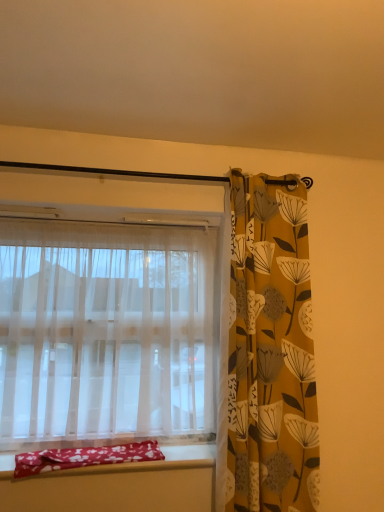
Question: Is yellow floral fabric curtain at right, which is the first curtain in right-to-left order, a part of sheer white curtain at left, which appears as the first curtain when viewed from the left?

Choices:
 (A) no
 (B) yes

Answer: (A)

Question: Is sheer white curtain at left, arranged as the second curtain when viewed from the right, smaller than yellow floral fabric curtain at right, which is the first curtain in right-to-left order?

Choices:
 (A) no
 (B) yes

Answer: (A)

Question: Is sheer white curtain at left, arranged as the second curtain when viewed from the right, in contact with yellow floral fabric curtain at right, the 2th curtain viewed from the left?

Choices:
 (A) yes
 (B) no

Answer: (B)

Question: Does sheer white curtain at left, which appears as the first curtain when viewed from the left, have a larger size compared to yellow floral fabric curtain at right, which is the first curtain in right-to-left order?

Choices:
 (A) yes
 (B) no

Answer: (A)

Question: Does sheer white curtain at left, arranged as the second curtain when viewed from the right, turn towards yellow floral fabric curtain at right, the 2th curtain viewed from the left?

Choices:
 (A) no
 (B) yes

Answer: (A)

Question: Does point (284, 509) appear closer or farther from the camera than point (107, 435)?

Choices:
 (A) closer
 (B) farther

Answer: (A)

Question: Looking at their shapes, would you say yellow floral fabric curtain at right, which is the first curtain in right-to-left order, is wider or thinner than sheer white curtain at left, which appears as the first curtain when viewed from the left?

Choices:
 (A) wide
 (B) thin

Answer: (B)

Question: From the image's perspective, is yellow floral fabric curtain at right, the 2th curtain viewed from the left, positioned above or below sheer white curtain at left, which appears as the first curtain when viewed from the left?

Choices:
 (A) above
 (B) below

Answer: (A)

Question: Would you say yellow floral fabric curtain at right, which is the first curtain in right-to-left order, is inside or outside sheer white curtain at left, which appears as the first curtain when viewed from the left?

Choices:
 (A) inside
 (B) outside

Answer: (B)

Question: From a real-world perspective, is red fabric pillow at lower left above or below yellow floral fabric curtain at right, which is the first curtain in right-to-left order?

Choices:
 (A) above
 (B) below

Answer: (B)

Question: From the image's perspective, is red fabric pillow at lower left positioned above or below yellow floral fabric curtain at right, the 2th curtain viewed from the left?

Choices:
 (A) below
 (B) above

Answer: (A)

Question: Is red fabric pillow at lower left in front of or behind yellow floral fabric curtain at right, the 2th curtain viewed from the left, in the image?

Choices:
 (A) front
 (B) behind

Answer: (B)

Question: Considering the positions of point (122, 457) and point (269, 335), is point (122, 457) closer or farther from the camera than point (269, 335)?

Choices:
 (A) farther
 (B) closer

Answer: (B)

Question: From the image's perspective, is yellow floral fabric curtain at right, which is the first curtain in right-to-left order, above or below red fabric pillow at lower left?

Choices:
 (A) below
 (B) above

Answer: (B)

Question: Considering the positions of yellow floral fabric curtain at right, which is the first curtain in right-to-left order, and red fabric pillow at lower left in the image, is yellow floral fabric curtain at right, which is the first curtain in right-to-left order, taller or shorter than red fabric pillow at lower left?

Choices:
 (A) tall
 (B) short

Answer: (A)